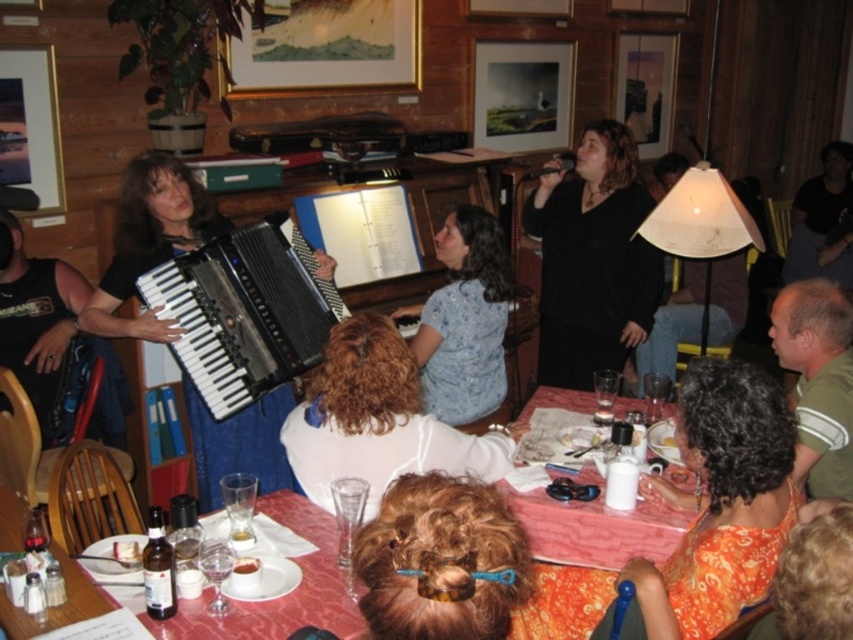
Based on the photo, is black matte dress at upper center further to camera compared to brown curly hair at center?

Yes, it is behind brown curly hair at center.

Is black matte dress at upper center above brown curly hair at center?

Yes.

Does point (618, 326) come closer to viewer compared to point (503, 534)?

No, (618, 326) is further to viewer.

At what (x,y) coordinates should I click in order to perform the action: click on black matte dress at upper center. Please return your answer as a coordinate pair (x, y). This screenshot has width=853, height=640. Looking at the image, I should click on click(x=592, y=259).

Image resolution: width=853 pixels, height=640 pixels. Describe the element at coordinates (592, 259) in the screenshot. I see `black matte dress at upper center` at that location.

Can you confirm if black matte dress at upper center is positioned to the left of metallic accordion at left?

No, black matte dress at upper center is not to the left of metallic accordion at left.

Image resolution: width=853 pixels, height=640 pixels. Describe the element at coordinates (592, 259) in the screenshot. I see `black matte dress at upper center` at that location.

Find the location of `black matte dress at upper center`. black matte dress at upper center is located at coordinates tap(592, 259).

Is orange fabric dress at lower right wider than white glossy table at lower center?

No, orange fabric dress at lower right is not wider than white glossy table at lower center.

How distant is orange fabric dress at lower right from white glossy table at lower center?

A distance of 35.22 centimeters exists between orange fabric dress at lower right and white glossy table at lower center.

Where is `orange fabric dress at lower right`? The image size is (853, 640). orange fabric dress at lower right is located at coordinates (720, 502).